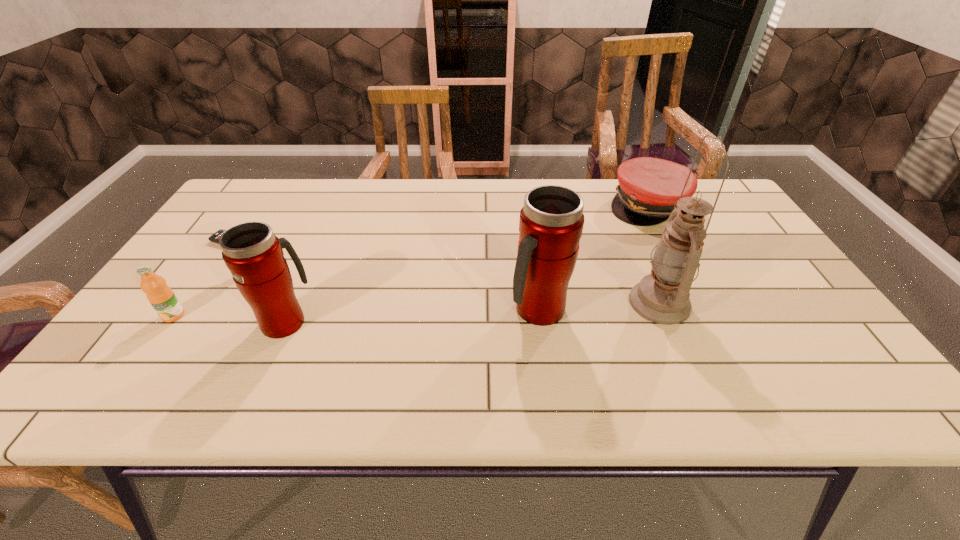
Image resolution: width=960 pixels, height=540 pixels. Find the location of `unoccupied area between the orange juice and the taller thermos bottle`. unoccupied area between the orange juice and the taller thermos bottle is located at coordinates (356, 313).

Identify the location of vacant point located between the remote control and the farthest object. Image resolution: width=960 pixels, height=540 pixels. (445, 225).

The height and width of the screenshot is (540, 960). Find the location of `free space between the orange juice and the fifth shortest object`. free space between the orange juice and the fifth shortest object is located at coordinates (356, 313).

The width and height of the screenshot is (960, 540). I want to click on vacant space that's between the shorter thermos bottle and the oil lamp, so click(472, 312).

Where is `vacant area between the second shortest object and the shorter thermos bottle`? This screenshot has width=960, height=540. vacant area between the second shortest object and the shorter thermos bottle is located at coordinates (467, 263).

Where is `vacant area between the second shortest object and the fourth tallest object`? The width and height of the screenshot is (960, 540). vacant area between the second shortest object and the fourth tallest object is located at coordinates (411, 260).

Point out which object is positioned as the second nearest to the tallest object. Please provide its 2D coordinates. Your answer should be formatted as a tuple, i.e. [(x, y)], where the tuple contains the x and y coordinates of a point satisfying the conditions above.

[(649, 188)]

Where is `object that stands as the fifth closest to the farthest object`? The width and height of the screenshot is (960, 540). object that stands as the fifth closest to the farthest object is located at coordinates (161, 297).

At what (x,y) coordinates should I click in order to perform the action: click on free space that satisfies the following two spatial constraints: 1. on the side with the handle of the oil lamp; 2. on the left side of the shorter thermos bottle. Please return your answer as a coordinate pair (x, y). Looking at the image, I should click on point(294,302).